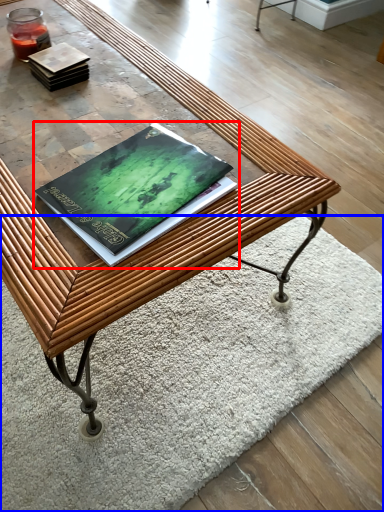
Question: Which object is closer to the camera taking this photo, book (highlighted by a red box) or mat (highlighted by a blue box)?

Choices:
 (A) book
 (B) mat

Answer: (A)